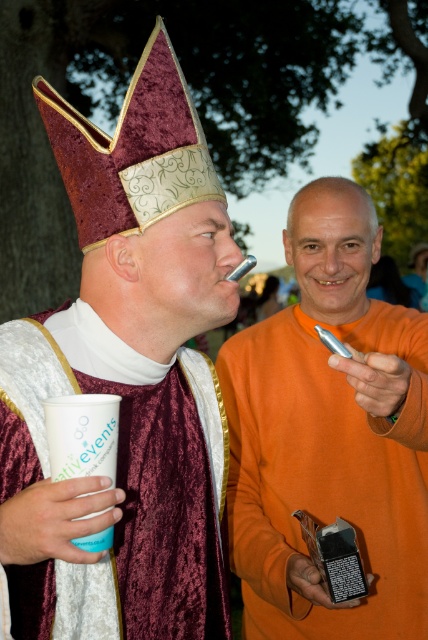
Question: Where is orange matte shirt at center located in relation to velvet maroon robe at center in the image?

Choices:
 (A) above
 (B) below

Answer: (A)

Question: Which of the following is the closest to the observer?

Choices:
 (A) (101, 364)
 (B) (376, 548)

Answer: (A)

Question: Can you confirm if orange matte shirt at center is wider than velvet maroon robe at center?

Choices:
 (A) no
 (B) yes

Answer: (B)

Question: Among these objects, which one is farthest from the camera?

Choices:
 (A) orange matte shirt at center
 (B) velvet maroon robe at center

Answer: (A)

Question: Does orange matte shirt at center come behind velvet maroon robe at center?

Choices:
 (A) no
 (B) yes

Answer: (B)

Question: Which point is closer to the camera?

Choices:
 (A) orange matte shirt at center
 (B) velvet maroon robe at center

Answer: (B)